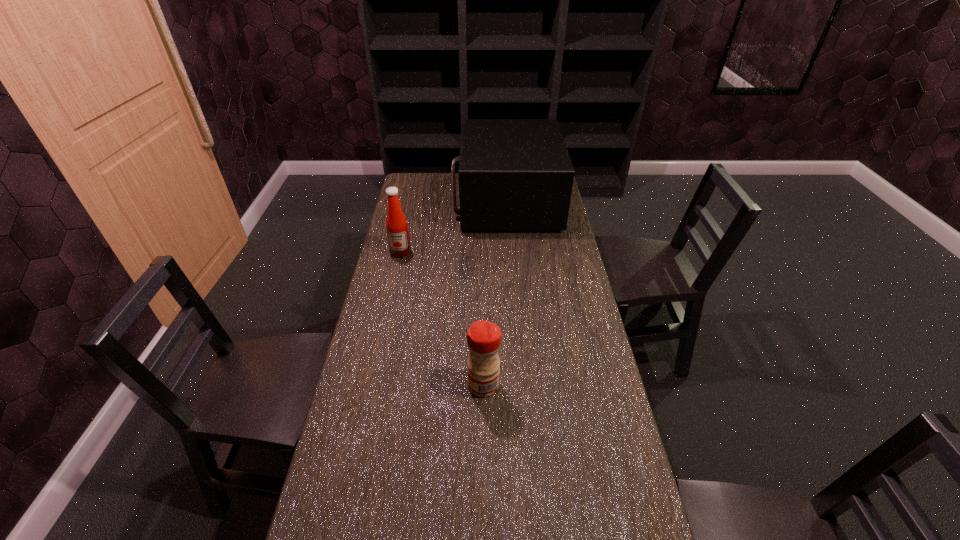
At what (x,y) coordinates should I click in order to perform the action: click on microwave oven. Please return your answer as a coordinate pair (x, y). Looking at the image, I should click on (514, 174).

At what (x,y) coordinates should I click in order to perform the action: click on the left condiment. Please return your answer as a coordinate pair (x, y). The height and width of the screenshot is (540, 960). Looking at the image, I should click on (396, 224).

Where is `the farther condiment`? The height and width of the screenshot is (540, 960). the farther condiment is located at coordinates (396, 224).

This screenshot has width=960, height=540. In order to click on the right condiment in this screenshot , I will do `click(483, 337)`.

This screenshot has width=960, height=540. Identify the location of the nearest object. (483, 337).

The height and width of the screenshot is (540, 960). Identify the location of free location located on the front-facing side of the farthest object. [443, 202].

Locate an element on the screen. This screenshot has height=540, width=960. blank space located 0.120m on the front-facing side of the farthest object is located at coordinates (429, 202).

Identify the location of vacant space situated on the front-facing side of the farthest object. This screenshot has height=540, width=960. (420, 202).

Find the location of a particular element. This screenshot has width=960, height=540. vacant space located on the front-facing side of the left condiment is located at coordinates (390, 301).

Find the location of a particular element. The image size is (960, 540). free location located 0.220m on the left of the shortest object is located at coordinates (392, 385).